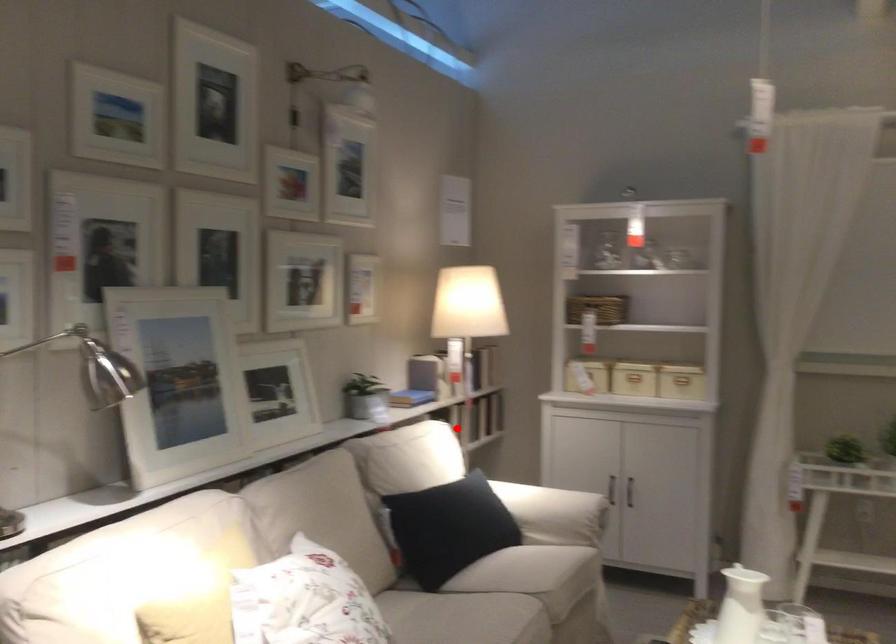
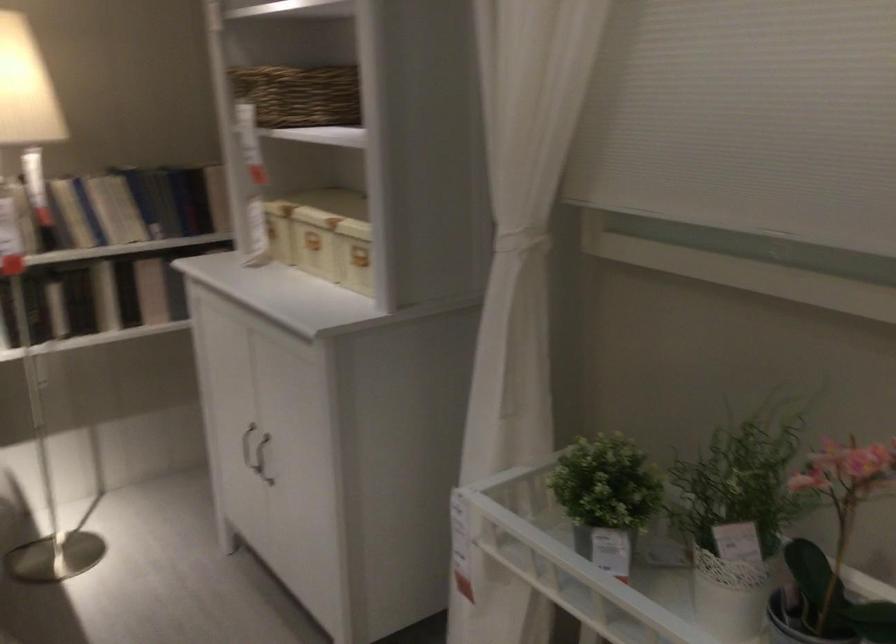
The point at the highlighted location is marked in the first image. Where is the corresponding point in the second image?

(55, 307)